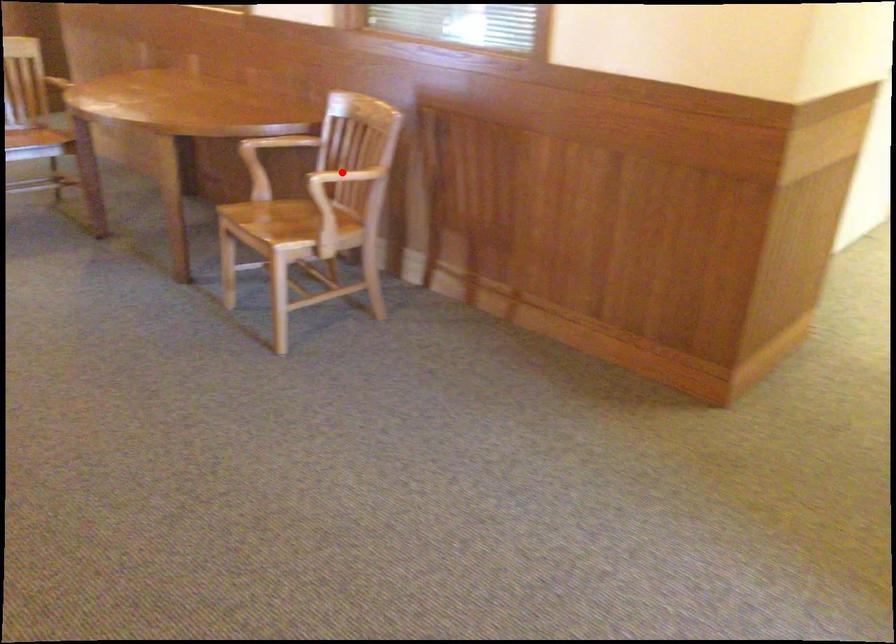
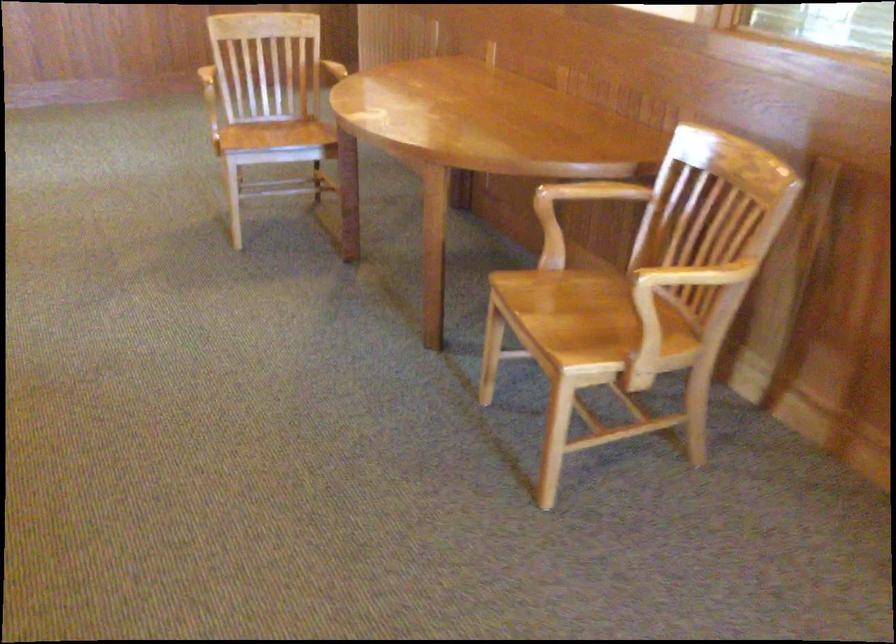
In the second image, find the point that corresponds to the highlighted location in the first image.

(696, 275)